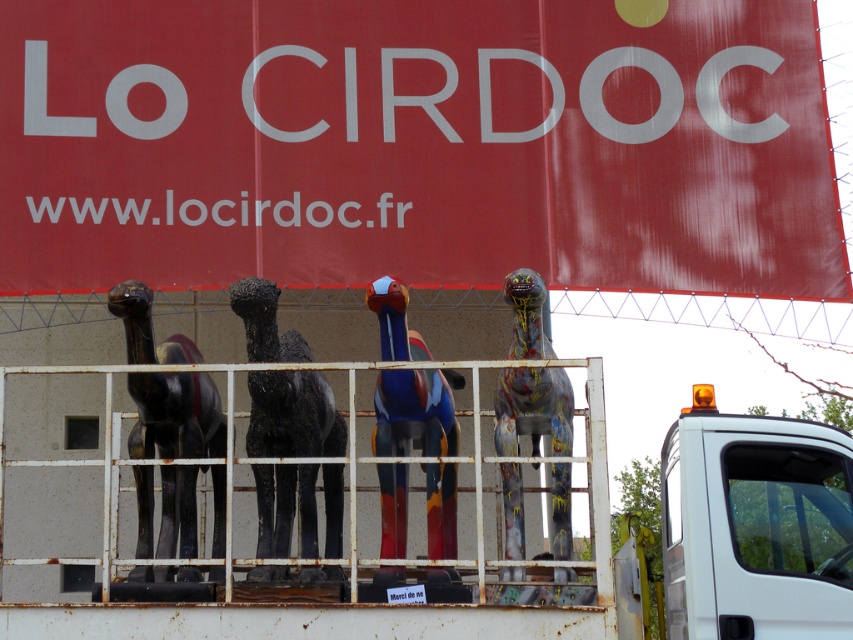
You are a delivery driver who needs to secure the painted wood dinosaur at center in the truck bed. The truck bed has a rusty metal rail at center. Will the dinosaur be visible above the rail?

The rusty metal rail at center has a lesser height compared to painted wood dinosaur at center, so yes, the dinosaur will be visible above the rail.

You are standing in front of a truck bed with a metal railing. You see a black matte horse at center and a painted wood bird at center. Which object is positioned to the left?

The black matte horse at center is positioned to the left of the painted wood bird at center according to the description.

You are a delivery driver who needs to read the text on the red matte sign at upper center. You are currently standing next to the white plastic truck at lower right. Can you read the sign without moving your position?

The red matte sign at upper center is further to the viewer than the white plastic truck at lower right, so you can read the sign without moving your position because it is closer to you than the truck.